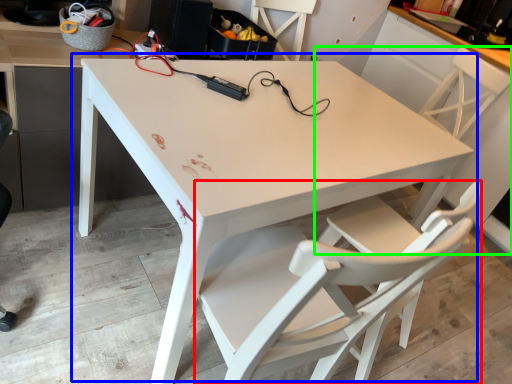
Question: Which object is the farthest from chair (highlighted by a red box)? Choose among these: table (highlighted by a blue box) or chair (highlighted by a green box).

Choices:
 (A) table
 (B) chair

Answer: (B)